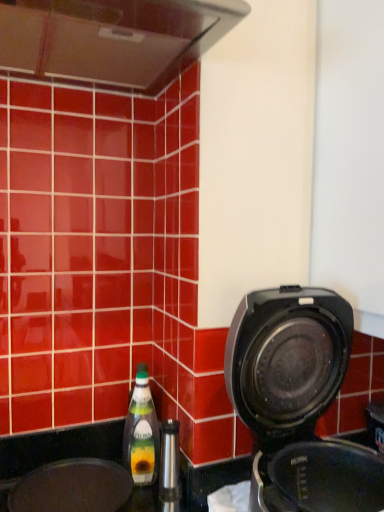
Question: Does black plastic coffee maker at right have a greater width compared to green glass bottle at lower left?

Choices:
 (A) yes
 (B) no

Answer: (A)

Question: Is black plastic coffee maker at right outside of green glass bottle at lower left?

Choices:
 (A) no
 (B) yes

Answer: (B)

Question: Is the depth of black plastic coffee maker at right less than that of green glass bottle at lower left?

Choices:
 (A) no
 (B) yes

Answer: (B)

Question: Is green glass bottle at lower left at the back of black plastic coffee maker at right?

Choices:
 (A) no
 (B) yes

Answer: (B)

Question: Does black plastic coffee maker at right contain green glass bottle at lower left?

Choices:
 (A) yes
 (B) no

Answer: (B)

Question: Is black plastic coffee maker at right shorter than green glass bottle at lower left?

Choices:
 (A) no
 (B) yes

Answer: (A)

Question: From the image's perspective, is black matte sink at lower left above green glass bottle at lower left?

Choices:
 (A) yes
 (B) no

Answer: (B)

Question: Does black matte sink at lower left lie in front of green glass bottle at lower left?

Choices:
 (A) no
 (B) yes

Answer: (B)

Question: Does black matte sink at lower left turn towards green glass bottle at lower left?

Choices:
 (A) yes
 (B) no

Answer: (B)

Question: From a real-world perspective, is black matte sink at lower left over green glass bottle at lower left?

Choices:
 (A) no
 (B) yes

Answer: (A)

Question: Is black matte sink at lower left at the left side of green glass bottle at lower left?

Choices:
 (A) no
 (B) yes

Answer: (B)

Question: Is black matte sink at lower left taller than green glass bottle at lower left?

Choices:
 (A) no
 (B) yes

Answer: (A)

Question: Is green glass bottle at lower left outside of black matte sink at lower left?

Choices:
 (A) no
 (B) yes

Answer: (B)